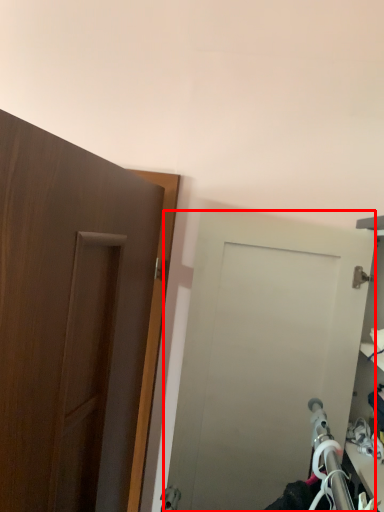
Question: Observing the image, what is the correct spatial positioning of door (annotated by the red box) in reference to door?

Choices:
 (A) left
 (B) right

Answer: (B)